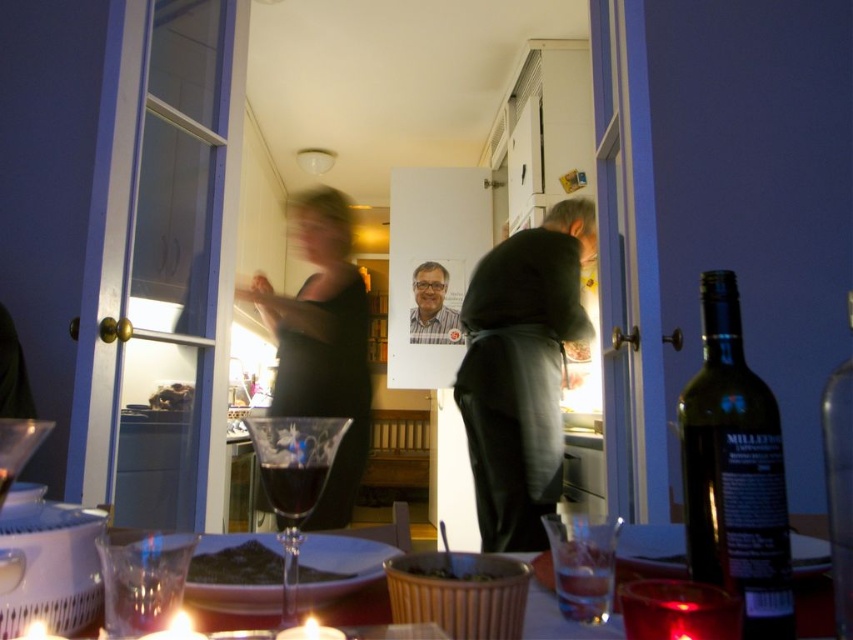
You are a guest at this dinner and need to grab a drink from the refrigerator. You notice the dark glass bottle at right and the black matte dress at center. Which object is narrower?

The dark glass bottle at right is thinner than the black matte dress at center, so the dark glass bottle at right is narrower.

Looking at this image, you are a guest at the dinner and want to pour wine from the translucent glass bottle at right into the transparent crystal wine glass at center. Will the glass be able to hold all the wine from the bottle?

The transparent crystal wine glass at center is bigger than the translucent glass bottle at right, so yes, the glass can hold all the wine from the bottle.

You are pouring wine from the translucent glass bottle at right into the transparent crystal wine glass at center. Will the wine flow into the glass?

Yes, the wine will flow into the transparent crystal wine glass at center because it is positioned under the translucent glass bottle at right.